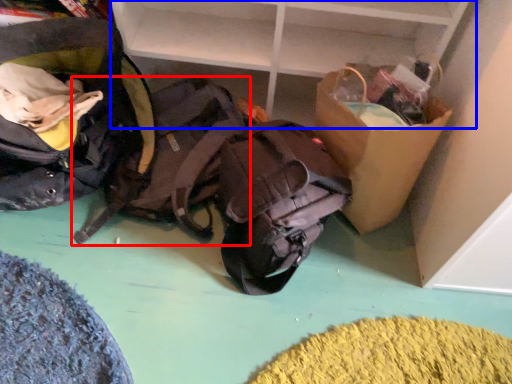
Question: Which object is closer to the camera taking this photo, backpack (highlighted by a red box) or shelf (highlighted by a blue box)?

Choices:
 (A) backpack
 (B) shelf

Answer: (B)